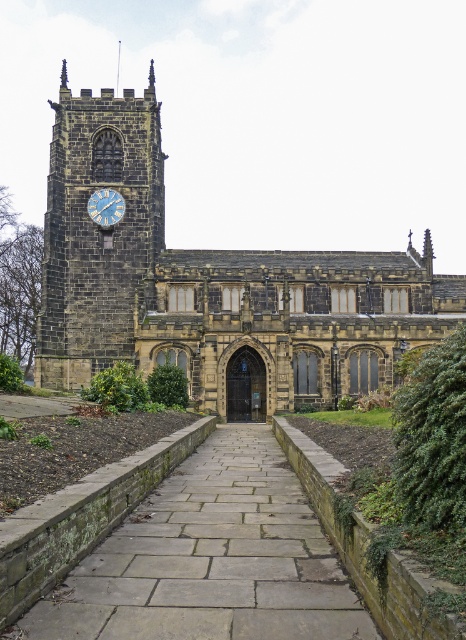
Is point (72, 580) in front of point (62, 86)?

Yes.

Find the location of a particular element. The image size is (466, 640). gray stone path at center is located at coordinates (211, 560).

This screenshot has height=640, width=466. What are the coordinates of `gray stone path at center` in the screenshot? It's located at (211, 560).

In the scene shown: Is dark gray stone church at center thinner than dark gray stone clock tower at upper left?

No.

Which is in front, point (82, 196) or point (145, 204)?

Point (145, 204)

The image size is (466, 640). Identify the location of dark gray stone church at center. tap(210, 284).

Who is taller, dark gray stone clock tower at upper left or blue painted metal clock at upper left?

dark gray stone clock tower at upper left is taller.

Between dark gray stone clock tower at upper left and blue painted metal clock at upper left, which one is positioned higher?

Positioned higher is dark gray stone clock tower at upper left.

Where is `dark gray stone clock tower at upper left`? This screenshot has height=640, width=466. dark gray stone clock tower at upper left is located at coordinates (98, 232).